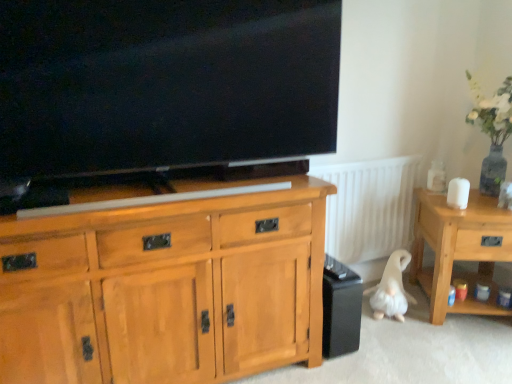
You are a GUI agent. You are given a task and a screenshot of the screen. Output one action in this format:
    pyautogui.click(x=<x>, y=<y>)
    Task: Click on the free space in front of light wood side table at right
    The width and height of the screenshot is (512, 384).
    Given the screenshot: What is the action you would take?
    (465, 351)